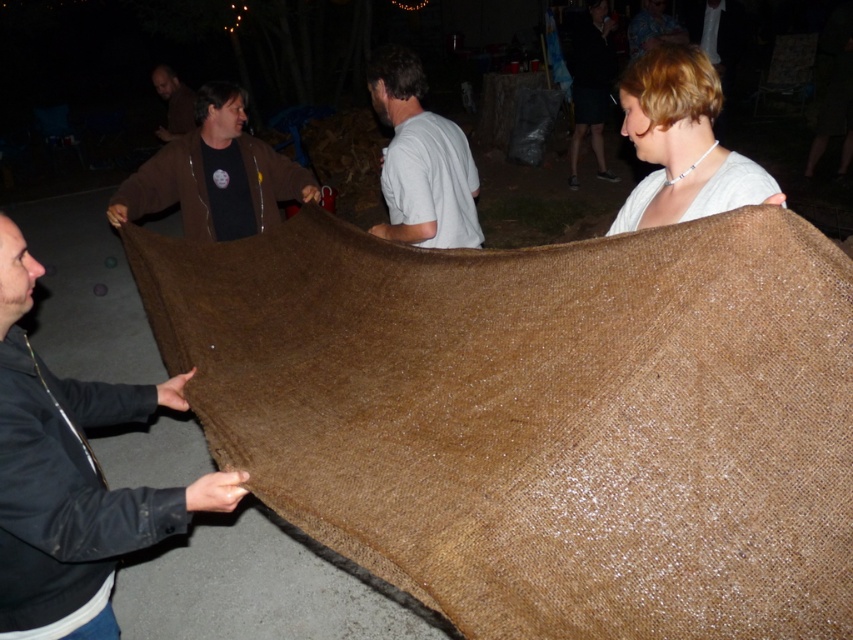
Is brown woven fabric at center further to camera compared to light brown fabric at upper right?

No, it is not.

How far apart are brown woven fabric at center and light brown fabric at upper right?

brown woven fabric at center and light brown fabric at upper right are 30.65 inches apart from each other.

In the scene shown: Who is more distant from viewer, (x=851, y=484) or (x=724, y=161)?

Point (x=724, y=161)

The image size is (853, 640). I want to click on brown woven fabric at center, so click(538, 416).

Who is more distant from viewer, [688,122] or [178,88]?

The point [178,88] is behind.

Can you confirm if light brown fabric at upper right is wider than brown fabric at upper left?

Incorrect, light brown fabric at upper right's width does not surpass brown fabric at upper left's.

Does point (645, 120) come behind point (158, 77)?

No, (645, 120) is closer to viewer.

I want to click on light brown fabric at upper right, so click(x=682, y=144).

Where is `matte brown skirt at upper right`? The image size is (853, 640). matte brown skirt at upper right is located at coordinates (590, 84).